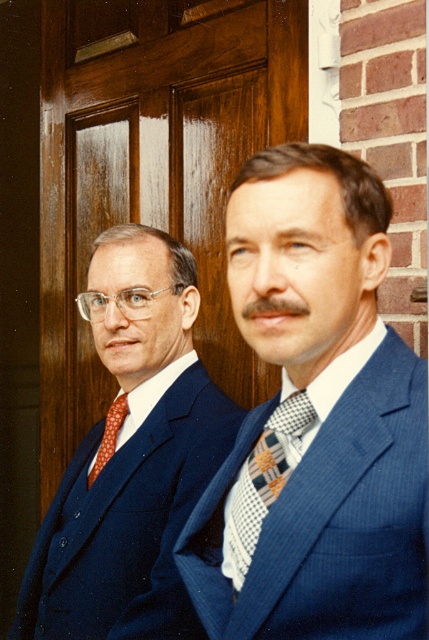
You are standing in front of the wooden door. Where is the wooden at center located in relation to the door?

The wooden at center is located at point (153, 170) in relation to the door.

You are a photographer setting up for a portrait shoot. You need to position a light source between the blue textured suit at center and the wooden at center. The light source has a diameter of 30 centimeters. Can the light source fit between them without overlapping either object?

The blue textured suit at center and wooden at center are 99.64 centimeters apart from each other. Since the light source has a diameter of 30 centimeters, there is sufficient space between them to place the light source without overlapping either object.

You are a photographer setting up a shot of the two men in front of the wooden door. You want to ensure the blue textured suit at center is visible above the wooden at center. Based on the scene description, is this possible?

The blue textured suit at center is positioned under the wooden at center, so it cannot be visible above it.